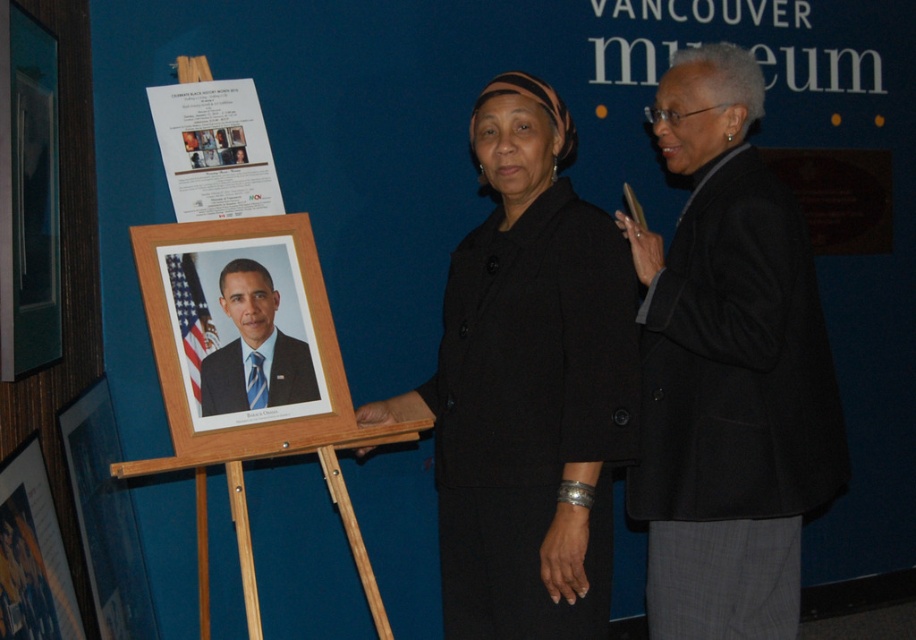
Question: Among these objects, which one is nearest to the camera?

Choices:
 (A) white paper poster at upper left
 (B) wooden easel at center

Answer: (B)

Question: Which object is the closest to the smooth glossy portrait at center?

Choices:
 (A) black wool coat at center
 (B) white paper poster at upper left
 (C) black wool jacket at right

Answer: (B)

Question: Is black wool jacket at right smaller than smooth glossy portrait at center?

Choices:
 (A) yes
 (B) no

Answer: (B)

Question: Can you confirm if black wool jacket at right is smaller than white paper poster at upper left?

Choices:
 (A) yes
 (B) no

Answer: (B)

Question: Can you confirm if black wool coat at center is thinner than black wool jacket at right?

Choices:
 (A) no
 (B) yes

Answer: (A)

Question: Which object is closer to the camera taking this photo?

Choices:
 (A) black wool coat at center
 (B) wooden easel at center

Answer: (A)